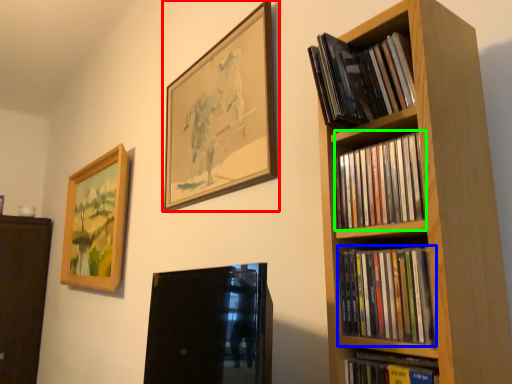
Question: Considering the real-world distances, which object is farthest from picture frame (highlighted by a red box)? book (highlighted by a blue box) or book (highlighted by a green box)?

Choices:
 (A) book
 (B) book

Answer: (A)